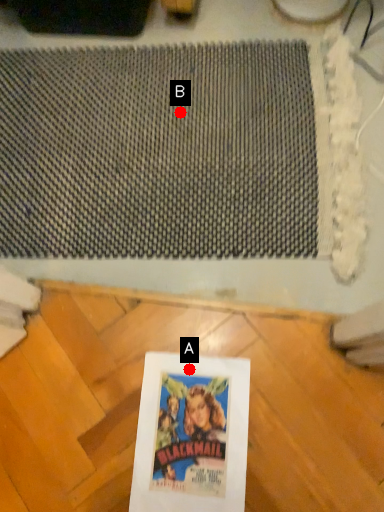
Question: Two points are circled on the image, labeled by A and B beside each circle. Which point is farther from the camera taking this photo?

Choices:
 (A) A is further
 (B) B is further

Answer: (B)